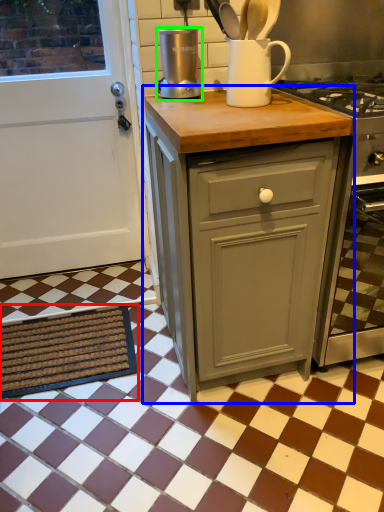
Question: Based on their relative distances, which object is nearer to doormat (highlighted by a red box)? Choose from cabinetry (highlighted by a blue box) and kitchen appliance (highlighted by a green box).

Choices:
 (A) cabinetry
 (B) kitchen appliance

Answer: (A)